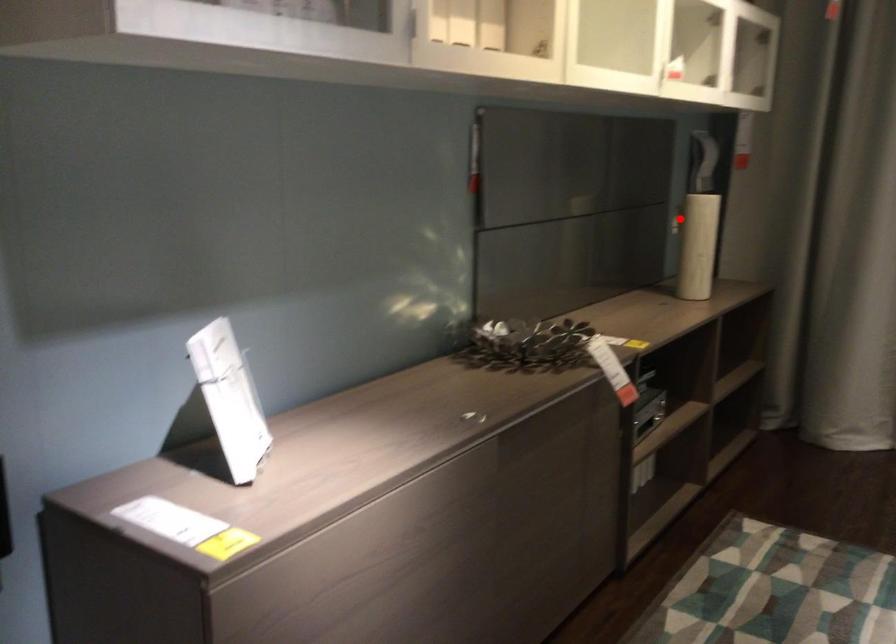
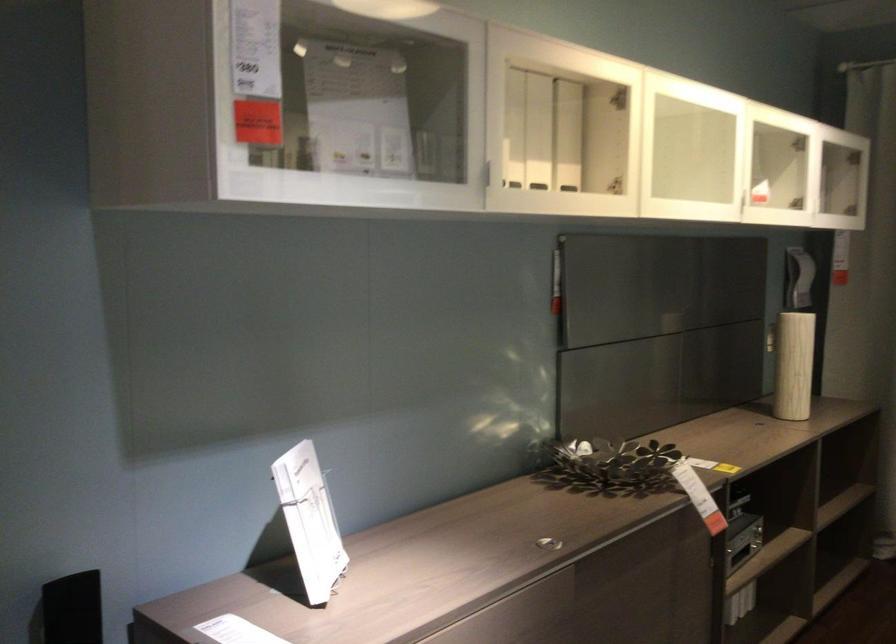
Find the pixel in the second image that matches the highlighted location in the first image.

(770, 339)